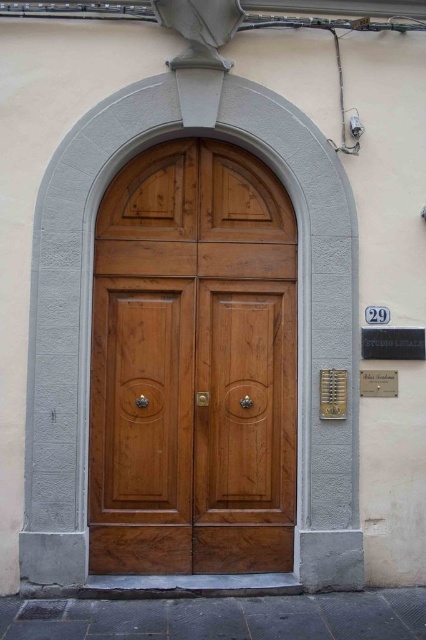
Between point (365, 336) and point (382, 388), which one is positioned behind?

Point (365, 336)

Is black metal plaque at center right wider than white marble plaque at center?

Yes, black metal plaque at center right is wider than white marble plaque at center.

Is point (380, 340) less distant than point (377, 392)?

That is False.

Image resolution: width=426 pixels, height=640 pixels. In order to click on black metal plaque at center right in this screenshot , I will do `click(393, 342)`.

Which of these two, walnut wood door at center or white marble plaque at center, stands shorter?

white marble plaque at center is shorter.

Which is in front, point (209, 150) or point (382, 392)?

Point (382, 392) is more forward.

Where is `walnut wood door at center`? Image resolution: width=426 pixels, height=640 pixels. walnut wood door at center is located at coordinates (192, 365).

Which is more to the left, black metal plaque at center right or metallic gold plaque at right?

From the viewer's perspective, metallic gold plaque at right appears more on the left side.

Between point (374, 346) and point (339, 381), which one is positioned behind?

Positioned behind is point (374, 346).

The image size is (426, 640). In order to click on black metal plaque at center right in this screenshot , I will do `click(393, 342)`.

The height and width of the screenshot is (640, 426). Find the location of `black metal plaque at center right`. black metal plaque at center right is located at coordinates (393, 342).